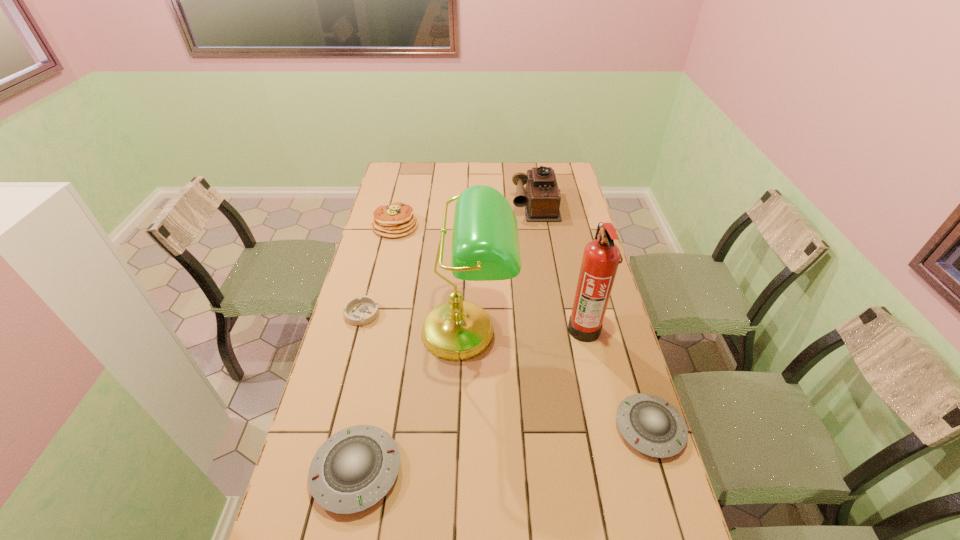
Identify the location of free region at the left edge. The image size is (960, 540). (388, 268).

Locate an element on the screen. The image size is (960, 540). free space at the right edge is located at coordinates (650, 479).

Locate an element on the screen. vacant region at the far left corner of the desktop is located at coordinates (384, 187).

Find the location of `vacant space at the near left corner of the desktop`. vacant space at the near left corner of the desktop is located at coordinates (309, 532).

Find the location of a particular element. The height and width of the screenshot is (540, 960). blank space at the far right corner of the desktop is located at coordinates (538, 164).

Image resolution: width=960 pixels, height=540 pixels. Find the location of `free space between the fire extinguisher and the second shortest object`. free space between the fire extinguisher and the second shortest object is located at coordinates (617, 378).

Identify the location of vacant space in between the sixth tallest object and the shortest object. (506, 371).

The width and height of the screenshot is (960, 540). Find the location of `blank region between the fire extinguisher and the shorter saucer`. blank region between the fire extinguisher and the shorter saucer is located at coordinates (617, 378).

Where is `empty space between the lamp and the fourth shortest object`? empty space between the lamp and the fourth shortest object is located at coordinates (431, 279).

This screenshot has height=540, width=960. In order to click on free spot between the right saucer and the fourth object from right to left in this screenshot , I will do `click(558, 380)`.